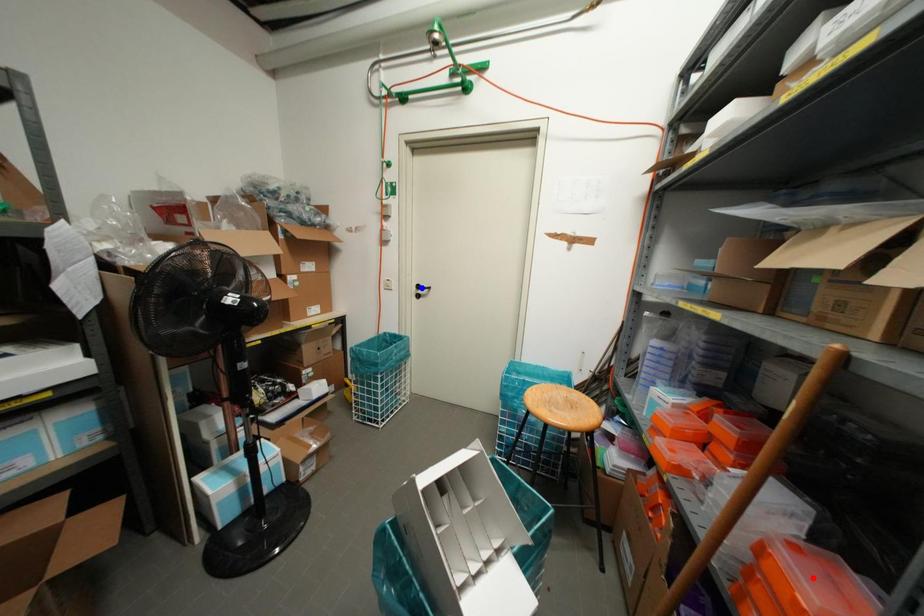
Question: Two points are marked on the image. Which point is closer to the camera?

Choices:
 (A) Blue point is closer.
 (B) Red point is closer.

Answer: (B)